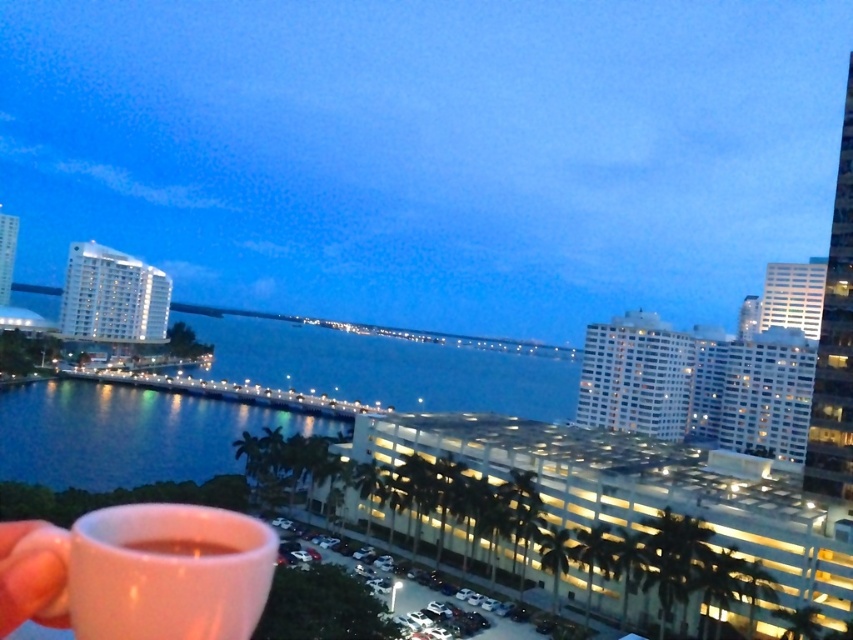
Question: Which point is closer to the camera taking this photo?

Choices:
 (A) (160, 404)
 (B) (374, 436)

Answer: (B)

Question: Does white concrete parking garage at center have a lesser width compared to blue water at center?

Choices:
 (A) no
 (B) yes

Answer: (B)

Question: Can you confirm if white glossy mug at lower left is wider than pink matte cup at lower left?

Choices:
 (A) yes
 (B) no

Answer: (A)

Question: Does white concrete parking garage at center appear under white glossy mug at lower left?

Choices:
 (A) yes
 (B) no

Answer: (A)

Question: Which is nearer to the white concrete parking garage at center?

Choices:
 (A) pink matte cup at lower left
 (B) white glossy mug at lower left
 (C) white glossy building at upper left

Answer: (B)

Question: Based on their relative distances, which object is nearer to the translucent glass cup at lower left?

Choices:
 (A) white glossy building at upper left
 (B) white concrete parking garage at center

Answer: (B)